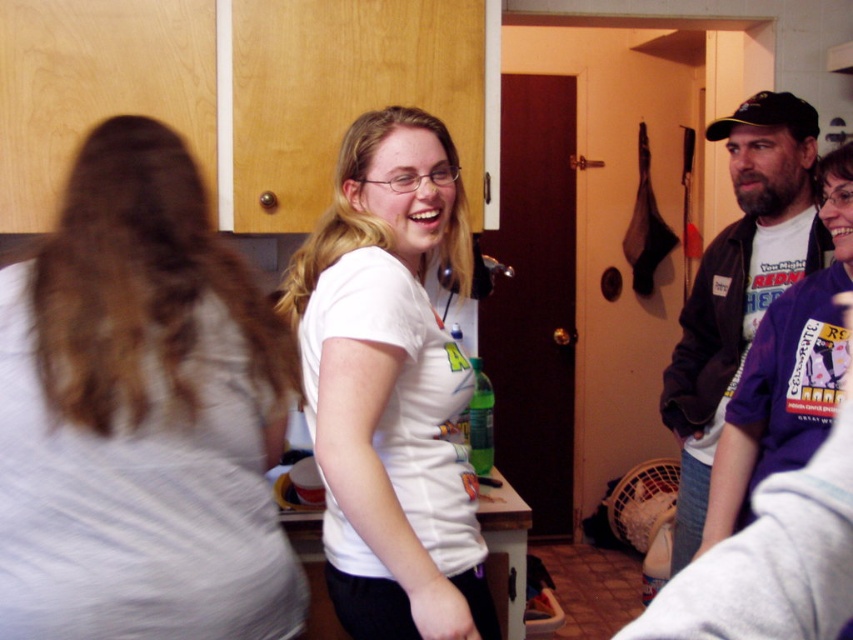
Who is higher up, light gray cotton shirt at center or dark brown leather jacket at right?

dark brown leather jacket at right

Between light gray cotton shirt at center and dark brown leather jacket at right, which one has less height?

light gray cotton shirt at center

Is point (239, 378) more distant than point (689, 321)?

No, it is in front of (689, 321).

You are a GUI agent. You are given a task and a screenshot of the screen. Output one action in this format:
    pyautogui.click(x=<x>, y=<y>)
    Task: Click on the light gray cotton shirt at center
    
    Given the screenshot: What is the action you would take?
    pyautogui.click(x=140, y=416)

Is white matte t-shirt at center positioned in front of dark brown leather jacket at right?

Yes, it is in front of dark brown leather jacket at right.

This screenshot has width=853, height=640. Find the location of `white matte t-shirt at center`. white matte t-shirt at center is located at coordinates (390, 387).

Can you confirm if light gray cotton shirt at center is bigger than white matte t-shirt at center?

Actually, light gray cotton shirt at center might be smaller than white matte t-shirt at center.

Can you confirm if light gray cotton shirt at center is taller than white matte t-shirt at center?

Incorrect, light gray cotton shirt at center's height is not larger of white matte t-shirt at center's.

Where is `light gray cotton shirt at center`? The height and width of the screenshot is (640, 853). light gray cotton shirt at center is located at coordinates point(140,416).